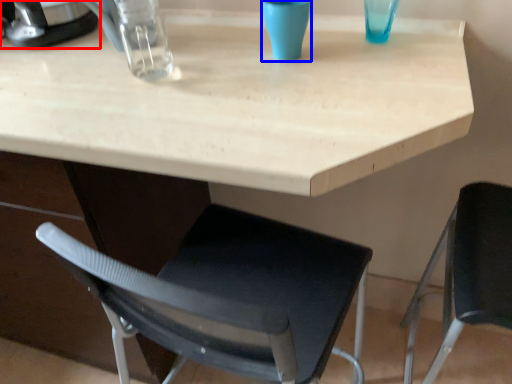
Question: Which point is further to the camera, appliance (highlighted by a red box) or clear (highlighted by a blue box)?

Choices:
 (A) appliance
 (B) clear

Answer: (A)